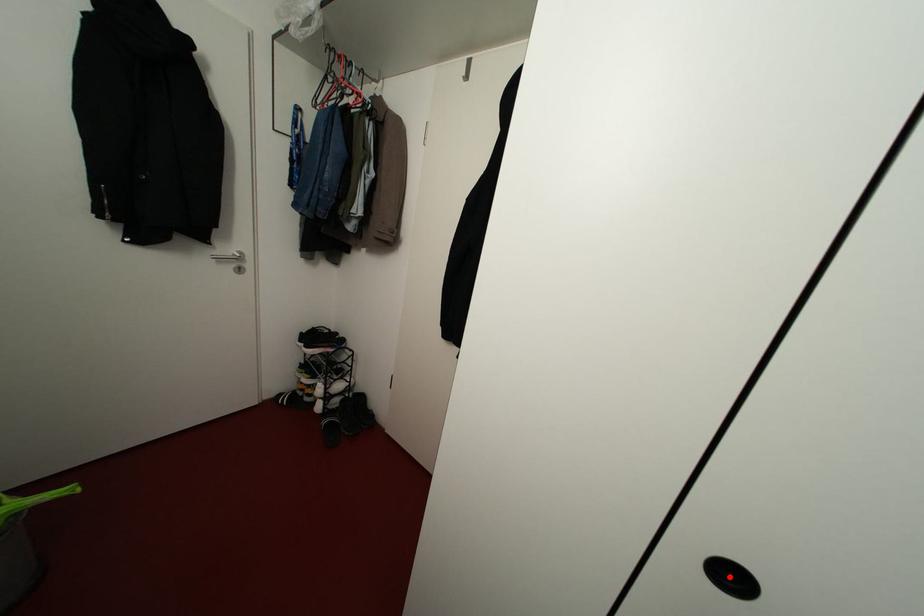
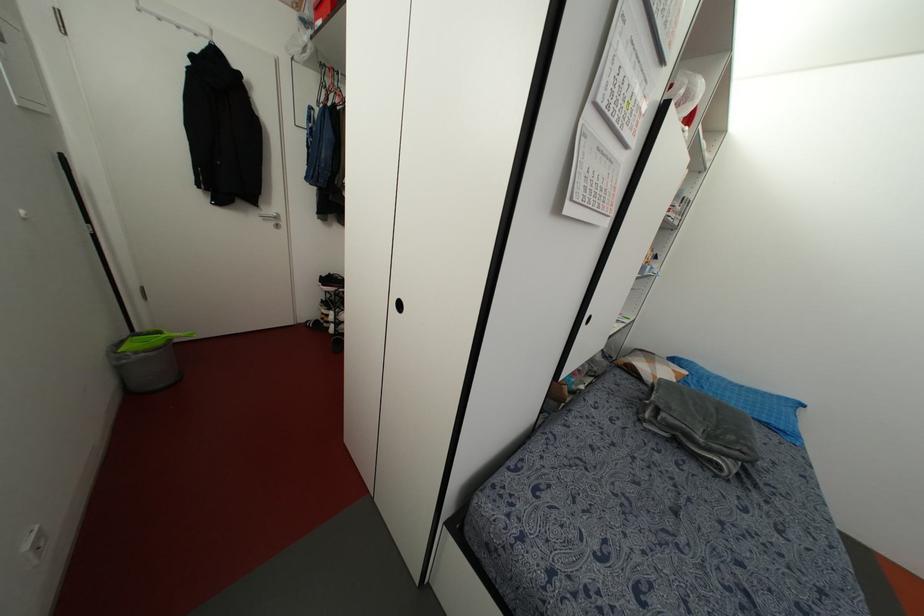
Where in the second image is the point corresponding to the highlighted location from the first image?

(398, 305)